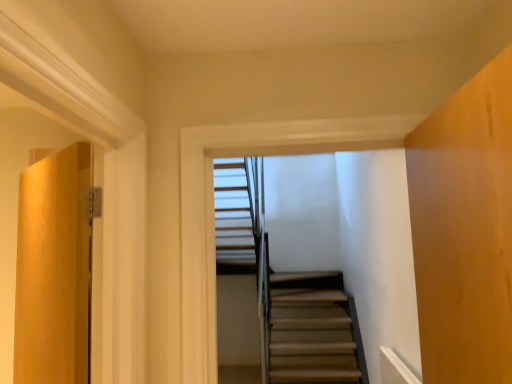
Question: Is wooden stairs at center facing towards matte wood door at left?

Choices:
 (A) no
 (B) yes

Answer: (A)

Question: Is wooden stairs at center not inside matte wood door at left?

Choices:
 (A) yes
 (B) no

Answer: (A)

Question: Is wooden stairs at center next to matte wood door at left and touching it?

Choices:
 (A) no
 (B) yes

Answer: (A)

Question: Is wooden stairs at center surrounding matte wood door at left?

Choices:
 (A) yes
 (B) no

Answer: (B)

Question: Considering the relative sizes of wooden stairs at center and matte wood door at left in the image provided, is wooden stairs at center thinner than matte wood door at left?

Choices:
 (A) yes
 (B) no

Answer: (A)

Question: Can you confirm if wooden stairs at center is taller than matte wood door at left?

Choices:
 (A) yes
 (B) no

Answer: (B)

Question: Does matte wood door at left have a greater width compared to wooden stairs at center?

Choices:
 (A) no
 (B) yes

Answer: (B)

Question: Is matte wood door at left at the right side of wooden stairs at center?

Choices:
 (A) no
 (B) yes

Answer: (A)

Question: Does matte wood door at left come in front of wooden stairs at center?

Choices:
 (A) no
 (B) yes

Answer: (B)

Question: Is matte wood door at left located outside wooden stairs at center?

Choices:
 (A) no
 (B) yes

Answer: (B)

Question: Is matte wood door at left taller than wooden stairs at center?

Choices:
 (A) yes
 (B) no

Answer: (A)

Question: Can you confirm if matte wood door at left is positioned to the left of wooden stairs at center?

Choices:
 (A) no
 (B) yes

Answer: (B)

Question: From the image's perspective, is matte wood door at left located above or below wooden stairs at center?

Choices:
 (A) above
 (B) below

Answer: (B)